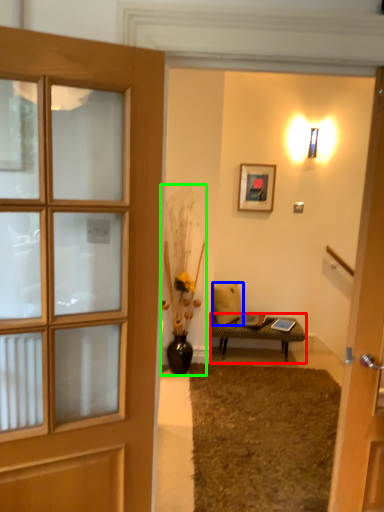
Question: Which object is positioned farthest from table (highlighted by a red box)? Select from pillow (highlighted by a blue box) and houseplant (highlighted by a green box).

Choices:
 (A) pillow
 (B) houseplant

Answer: (B)